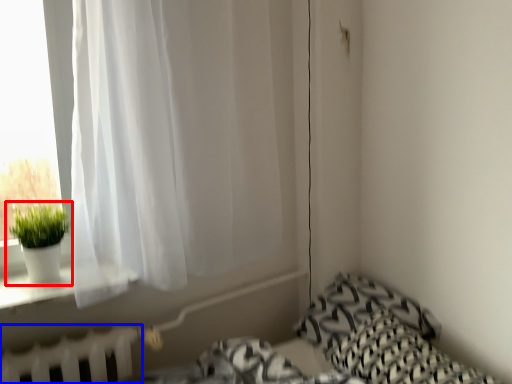
Question: Which point is further to the camera, houseplant (highlighted by a red box) or radiator (highlighted by a blue box)?

Choices:
 (A) houseplant
 (B) radiator

Answer: (A)